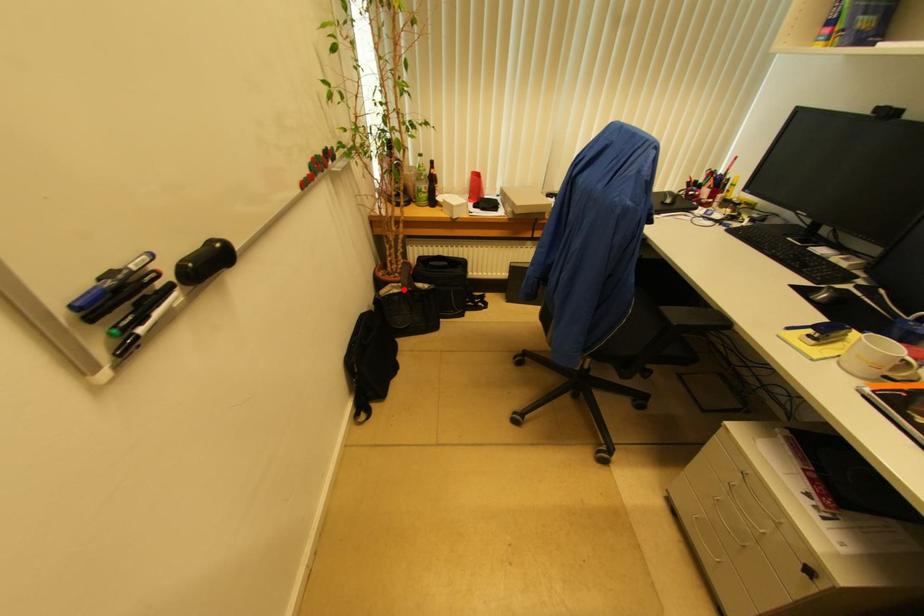
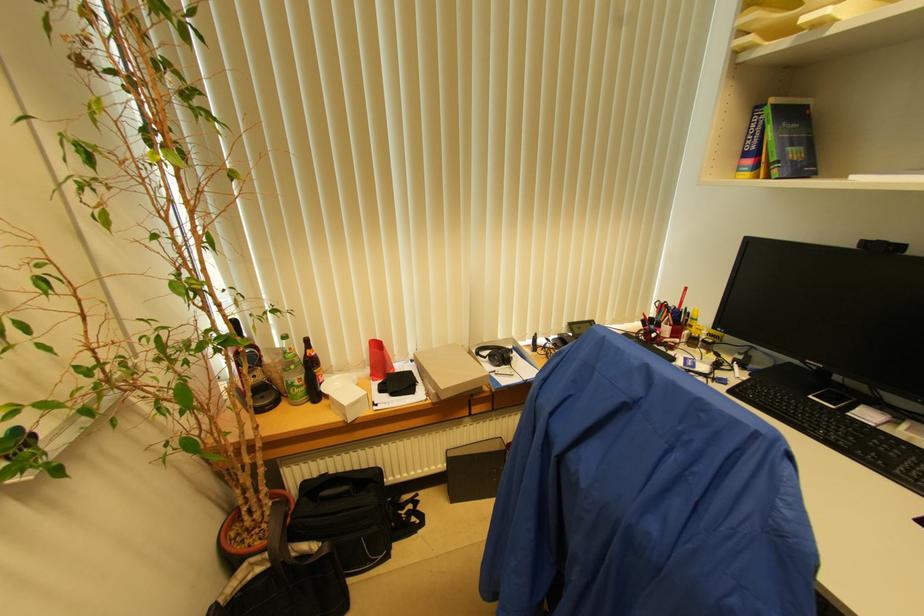
Find the pixel in the second image that matches the highlighted location in the first image.

(273, 561)